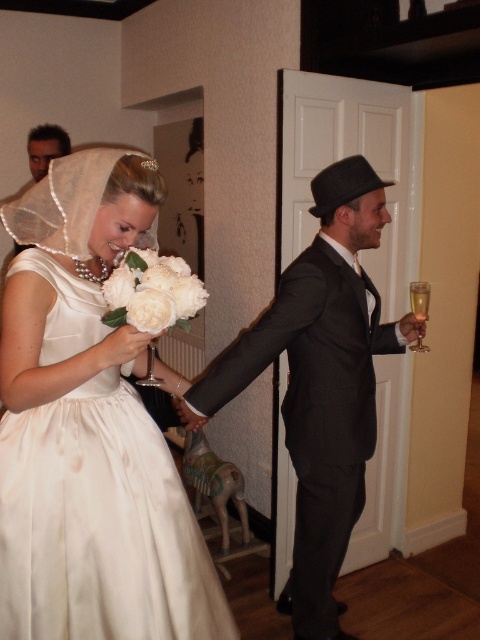
Question: Which point is farther from the camera taking this photo?

Choices:
 (A) (323, 522)
 (B) (144, 257)

Answer: (A)

Question: Does satin dress at left come in front of white silk bouquet at center?

Choices:
 (A) no
 (B) yes

Answer: (B)

Question: Which object is farther from the camera taking this photo?

Choices:
 (A) satin dress at left
 (B) white silk bouquet at center

Answer: (B)

Question: Which object is positioned farthest from the white silk bouquet at center?

Choices:
 (A) satin dress at left
 (B) shiny black suit at center

Answer: (B)

Question: Does satin dress at left have a larger size compared to white silk bouquet at center?

Choices:
 (A) yes
 (B) no

Answer: (A)

Question: Is satin dress at left above white silk bouquet at center?

Choices:
 (A) yes
 (B) no

Answer: (B)